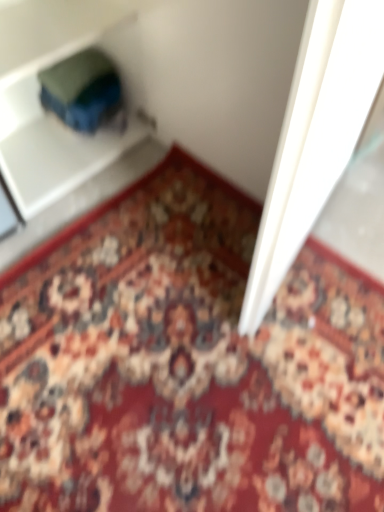
Where is `empty space that is ontop of floral carpet at center (from a real-world perspective)`? This screenshot has height=512, width=384. empty space that is ontop of floral carpet at center (from a real-world perspective) is located at coordinates (131, 400).